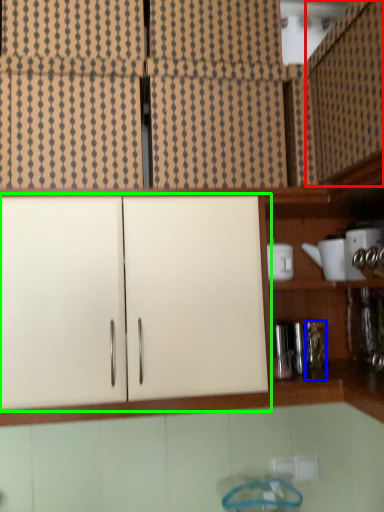
Question: Which is farther away from cabinetry (highlighted by a red box)? bottle (highlighted by a blue box) or cabinetry (highlighted by a green box)?

Choices:
 (A) bottle
 (B) cabinetry

Answer: (A)